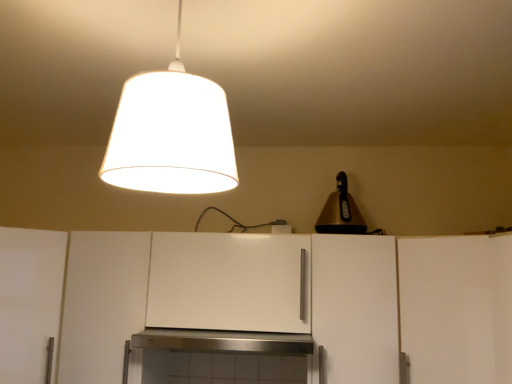
Question: Would you say white matte cabinet at center, which ranks as the third cabinetry in left-to-right order, is outside white matte cabinet at right, which is counted as the 5th cabinetry, starting from the left?

Choices:
 (A) yes
 (B) no

Answer: (A)

Question: Is white matte cabinet at center, which ranks as the third cabinetry in left-to-right order, wider than white matte cabinet at right, which is counted as the 5th cabinetry, starting from the left?

Choices:
 (A) yes
 (B) no

Answer: (B)

Question: Considering the relative sizes of white matte cabinet at center, which ranks as the third cabinetry in left-to-right order, and white matte cabinet at right, which is counted as the 5th cabinetry, starting from the left, in the image provided, is white matte cabinet at center, which ranks as the third cabinetry in left-to-right order, thinner than white matte cabinet at right, which is counted as the 5th cabinetry, starting from the left,?

Choices:
 (A) no
 (B) yes

Answer: (B)

Question: Does white matte cabinet at center, arranged as the third cabinetry when viewed from the right, contain white matte cabinet at right, which is counted as the 5th cabinetry, starting from the left?

Choices:
 (A) yes
 (B) no

Answer: (B)

Question: Is white matte cabinet at center, arranged as the third cabinetry when viewed from the right, in front of white matte cabinet at right, which ranks as the 1th cabinetry in right-to-left order?

Choices:
 (A) no
 (B) yes

Answer: (A)

Question: Based on their sizes in the image, would you say white fabric lampshade at upper center, which appears as the second lamp when viewed from the back, is bigger or smaller than white matte cabinet at right, which is counted as the 5th cabinetry, starting from the left?

Choices:
 (A) small
 (B) big

Answer: (A)

Question: In the image, is white fabric lampshade at upper center, placed as the 1th lamp when sorted from front to back, on the left side or the right side of white matte cabinet at right, which ranks as the 1th cabinetry in right-to-left order?

Choices:
 (A) right
 (B) left

Answer: (B)

Question: From the image's perspective, relative to white matte cabinet at right, which ranks as the 1th cabinetry in right-to-left order, is white fabric lampshade at upper center, placed as the 1th lamp when sorted from front to back, above or below?

Choices:
 (A) below
 (B) above

Answer: (B)

Question: Is white fabric lampshade at upper center, which ranks as the 1th lamp in left-to-right order, wider or thinner than white matte cabinet at right, which is counted as the 5th cabinetry, starting from the left?

Choices:
 (A) thin
 (B) wide

Answer: (A)

Question: Visually, is white matte cabinet at left, the fifth cabinetry viewed from the right, positioned to the left or to the right of white matte cabinet at right, which ranks as the 1th cabinetry in right-to-left order?

Choices:
 (A) right
 (B) left

Answer: (B)

Question: In terms of height, does white matte cabinet at left, the fifth cabinetry viewed from the right, look taller or shorter compared to white matte cabinet at right, which ranks as the 1th cabinetry in right-to-left order?

Choices:
 (A) short
 (B) tall

Answer: (B)

Question: Is point (8, 349) positioned closer to the camera than point (502, 268)?

Choices:
 (A) closer
 (B) farther

Answer: (B)

Question: Considering the positions of white matte cabinet at left, the fifth cabinetry viewed from the right, and white matte cabinet at right, which is counted as the 5th cabinetry, starting from the left, in the image, is white matte cabinet at left, the fifth cabinetry viewed from the right, wider or thinner than white matte cabinet at right, which is counted as the 5th cabinetry, starting from the left,?

Choices:
 (A) thin
 (B) wide

Answer: (B)

Question: Does point 347,213 appear closer or farther from the camera than point 35,248?

Choices:
 (A) closer
 (B) farther

Answer: (B)

Question: In terms of width, does gold metallic bell at upper right, the 2th lamp in the front-to-back sequence, look wider or thinner when compared to white matte cabinet at left, the first cabinetry viewed from the left?

Choices:
 (A) thin
 (B) wide

Answer: (A)